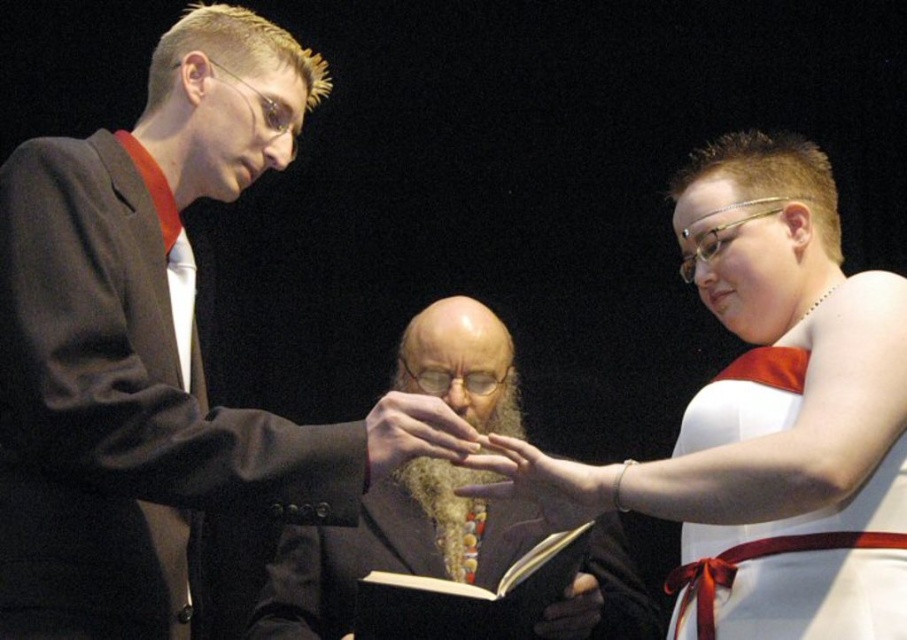
You are an event planner organizing a formal ceremony. You need to place a decorative item between the black leather book at center and the smooth skin hand at center. Which object should you place it closer to if you want it to be near the smaller object?

The smooth skin hand at center is smaller than the black leather book at center, so placing the decorative item closer to the smooth skin hand at center would position it near the smaller object.

Based on the scene description, which object is wider, the bearded man at center or the black leather book at center?

The bearded man at center is wider than the black leather book at center according to the description.

You are an event planner observing the scene. You need to arrange a photo shoot where the matte black suit at left and the golden curly beard at center are both in focus. Which object should be placed closer to the camera to ensure both are in focus?

The golden curly beard at center should be placed closer to the camera since the matte black suit at left is located above it. This way, both will be within the depth of field.